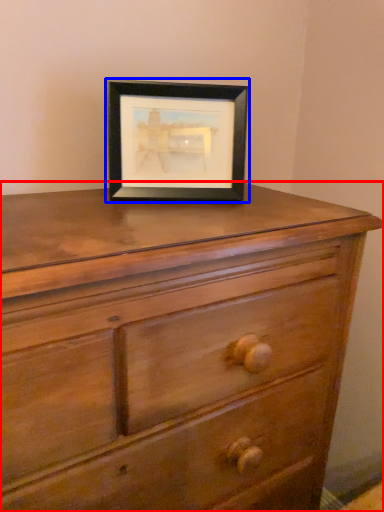
Question: Which object appears closest to the camera in this image, chest of drawers (highlighted by a red box) or picture frame (highlighted by a blue box)?

Choices:
 (A) chest of drawers
 (B) picture frame

Answer: (A)